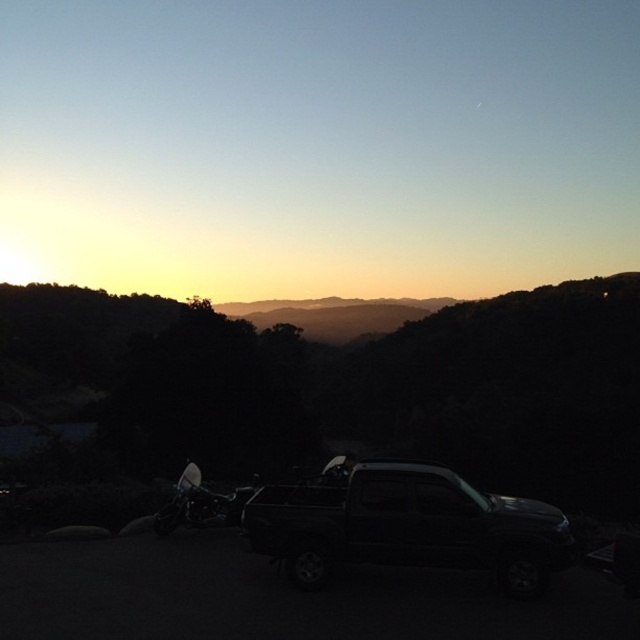
You are standing at the origin point of the image coordinate system, which is the bottom left corner. You see a black matte truck at center represented by point [406,525]. What is the coordinate of the black matte truck at center?

The black matte truck at center is represented by point [406,525].

You are a photographer planning to capture the sunset scene with the black matte truck at center and the shiny black motorcycle at lower left. Since you want to emphasize both objects equally in your composition, which object should you adjust the camera focus to prioritize based on their sizes?

The black matte truck at center occupies less space than the shiny black motorcycle at lower left, so to emphasize both equally, you should focus more on the smaller black matte truck at center to balance their visual weight in the composition.